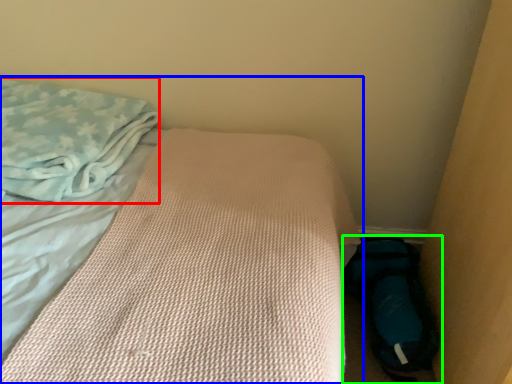
Question: Which object is positioned farthest from cloth (highlighted by a red box)? Select from bed (highlighted by a blue box) and footwear (highlighted by a green box).

Choices:
 (A) bed
 (B) footwear

Answer: (B)